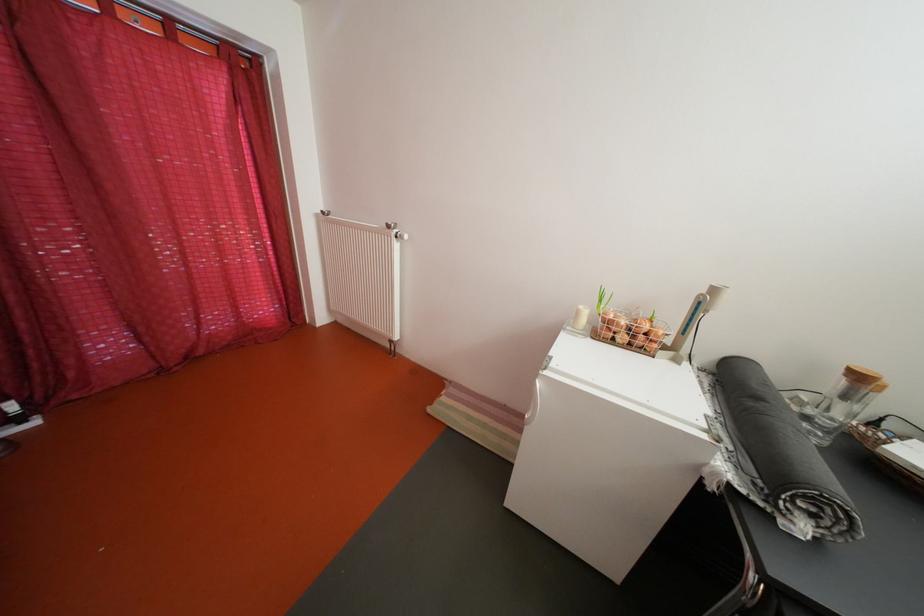
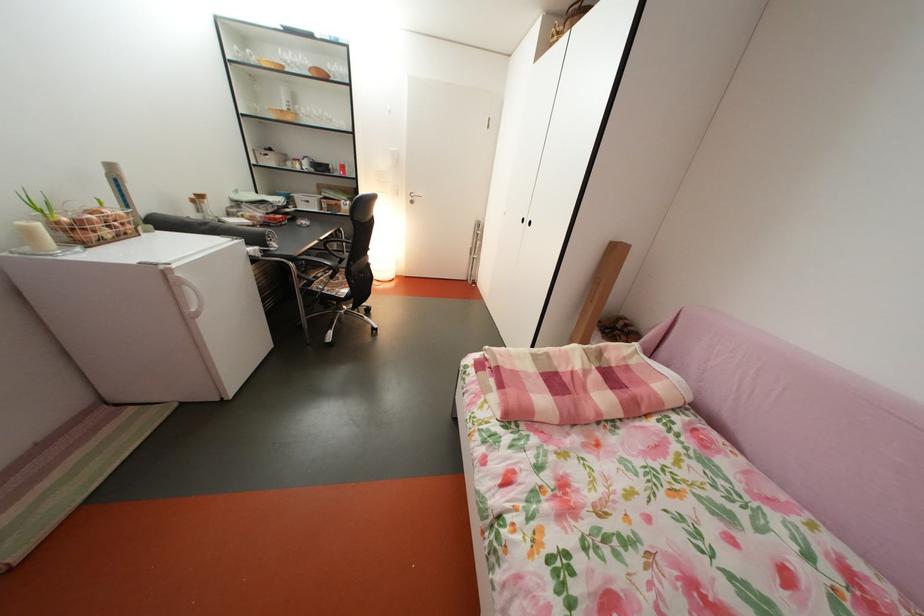
Where in the second image is the point corresponding to [635,345] from the first image?

(118, 238)